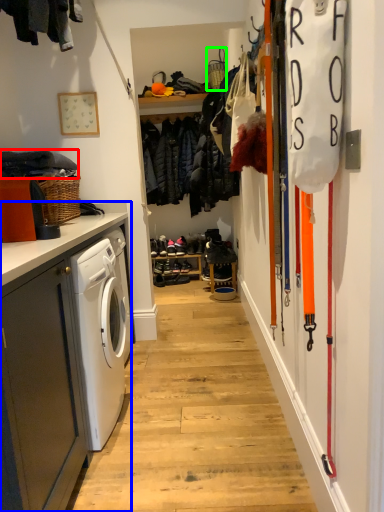
Question: Estimate the real-world distances between objects in this image. Which object is farther from clothing (highlighted by a red box), cabinetry (highlighted by a blue box) or basket (highlighted by a green box)?

Choices:
 (A) cabinetry
 (B) basket

Answer: (B)